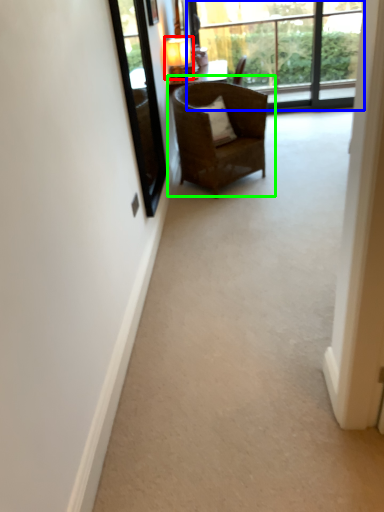
Question: Estimate the real-world distances between objects in this image. Which object is closer to lamp (highlighted by a red box), window (highlighted by a blue box) or chair (highlighted by a green box)?

Choices:
 (A) window
 (B) chair

Answer: (B)